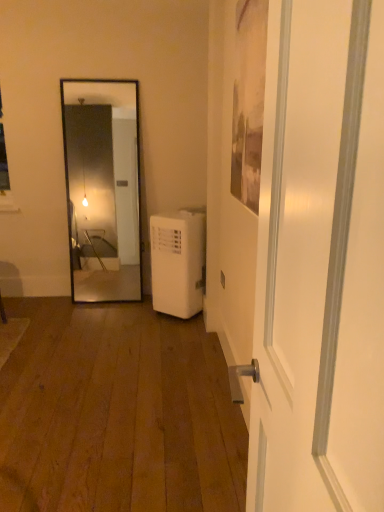
Question: Should I look upward or downward to see white plastic air conditioner at lower right?

Choices:
 (A) up
 (B) down

Answer: (B)

Question: From the image's perspective, is white plastic air conditioner at lower right above white glossy door at center?

Choices:
 (A) no
 (B) yes

Answer: (B)

Question: Does white plastic air conditioner at lower right touch white glossy door at center?

Choices:
 (A) yes
 (B) no

Answer: (B)

Question: Is white plastic air conditioner at lower right not near white glossy door at center?

Choices:
 (A) no
 (B) yes

Answer: (B)

Question: Considering the relative positions of white plastic air conditioner at lower right and white glossy door at center in the image provided, is white plastic air conditioner at lower right in front of white glossy door at center?

Choices:
 (A) no
 (B) yes

Answer: (A)

Question: From a real-world perspective, is white plastic air conditioner at lower right under white glossy door at center?

Choices:
 (A) yes
 (B) no

Answer: (A)

Question: From the image's perspective, is white plastic air conditioner at lower right under white glossy door at center?

Choices:
 (A) no
 (B) yes

Answer: (A)

Question: From a real-world perspective, is white glossy door at center on white plastic air conditioner at lower right?

Choices:
 (A) no
 (B) yes

Answer: (B)

Question: Considering the relative positions of white glossy door at center and white plastic air conditioner at lower right in the image provided, is white glossy door at center to the left of white plastic air conditioner at lower right from the viewer's perspective?

Choices:
 (A) yes
 (B) no

Answer: (B)

Question: From the image's perspective, is white glossy door at center over white plastic air conditioner at lower right?

Choices:
 (A) no
 (B) yes

Answer: (A)

Question: From the image's perspective, is white glossy door at center below white plastic air conditioner at lower right?

Choices:
 (A) yes
 (B) no

Answer: (A)

Question: Is white glossy door at center not close to white plastic air conditioner at lower right?

Choices:
 (A) yes
 (B) no

Answer: (A)

Question: Can you confirm if white glossy door at center is thinner than white plastic air conditioner at lower right?

Choices:
 (A) yes
 (B) no

Answer: (A)

Question: Considering the positions of point (301, 437) and point (185, 224), is point (301, 437) closer or farther from the camera than point (185, 224)?

Choices:
 (A) closer
 (B) farther

Answer: (A)